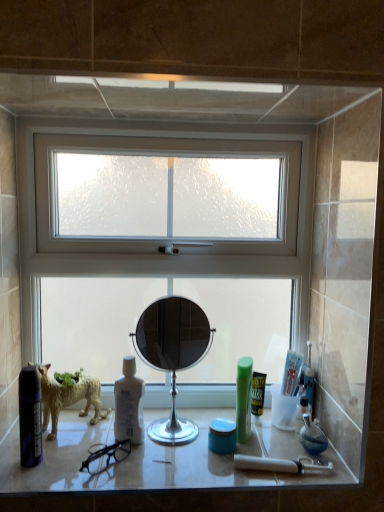
The image size is (384, 512). Find the location of `free location in front of silver/metallic mirror at center`. free location in front of silver/metallic mirror at center is located at coordinates (173, 464).